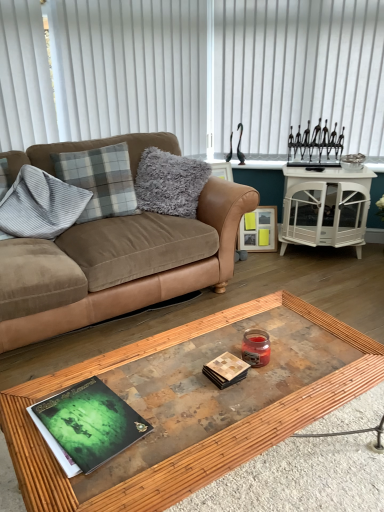
Question: From the image's perspective, is gray corduroy pillow at left, which ranks as the 3th pillow in right-to-left order, above plaid fabric pillow at upper left, which ranks as the second pillow in left-to-right order?

Choices:
 (A) no
 (B) yes

Answer: (A)

Question: From a real-world perspective, is gray corduroy pillow at left, which ranks as the 3th pillow in right-to-left order, physically below plaid fabric pillow at upper left, the 2th pillow in the right-to-left sequence?

Choices:
 (A) no
 (B) yes

Answer: (B)

Question: Is plaid fabric pillow at upper left, the 2th pillow in the right-to-left sequence, inside gray corduroy pillow at left, the first pillow when ordered from left to right?

Choices:
 (A) yes
 (B) no

Answer: (B)

Question: From the image's perspective, would you say gray corduroy pillow at left, which ranks as the 3th pillow in right-to-left order, is shown under plaid fabric pillow at upper left, the 2th pillow in the right-to-left sequence?

Choices:
 (A) yes
 (B) no

Answer: (A)

Question: Is gray corduroy pillow at left, the first pillow when ordered from left to right, to the left of plaid fabric pillow at upper left, the 2th pillow in the right-to-left sequence, from the viewer's perspective?

Choices:
 (A) yes
 (B) no

Answer: (A)

Question: Considering the relative sizes of gray corduroy pillow at left, which ranks as the 3th pillow in right-to-left order, and plaid fabric pillow at upper left, the 2th pillow in the right-to-left sequence, in the image provided, is gray corduroy pillow at left, which ranks as the 3th pillow in right-to-left order, shorter than plaid fabric pillow at upper left, the 2th pillow in the right-to-left sequence,?

Choices:
 (A) no
 (B) yes

Answer: (A)

Question: Is plaid fabric pillow at upper left, which ranks as the second pillow in left-to-right order, positioned far away from gray corduroy pillow at left, which ranks as the 3th pillow in right-to-left order?

Choices:
 (A) yes
 (B) no

Answer: (B)

Question: Does plaid fabric pillow at upper left, which ranks as the second pillow in left-to-right order, have a greater height compared to gray corduroy pillow at left, which ranks as the 3th pillow in right-to-left order?

Choices:
 (A) yes
 (B) no

Answer: (B)

Question: Can you confirm if plaid fabric pillow at upper left, which ranks as the second pillow in left-to-right order, is positioned to the left of gray corduroy pillow at left, which ranks as the 3th pillow in right-to-left order?

Choices:
 (A) no
 (B) yes

Answer: (A)

Question: From the image's perspective, is plaid fabric pillow at upper left, which ranks as the second pillow in left-to-right order, below gray corduroy pillow at left, which ranks as the 3th pillow in right-to-left order?

Choices:
 (A) yes
 (B) no

Answer: (B)

Question: Is plaid fabric pillow at upper left, which ranks as the second pillow in left-to-right order, thinner than gray corduroy pillow at left, the first pillow when ordered from left to right?

Choices:
 (A) no
 (B) yes

Answer: (B)

Question: Can you confirm if plaid fabric pillow at upper left, which ranks as the second pillow in left-to-right order, is wider than gray corduroy pillow at left, the first pillow when ordered from left to right?

Choices:
 (A) no
 (B) yes

Answer: (A)

Question: Does plaid fabric pillow at upper left, which ranks as the second pillow in left-to-right order, touch gray fluffy pillow at upper left, marked as the 3th pillow in a left-to-right arrangement?

Choices:
 (A) yes
 (B) no

Answer: (B)